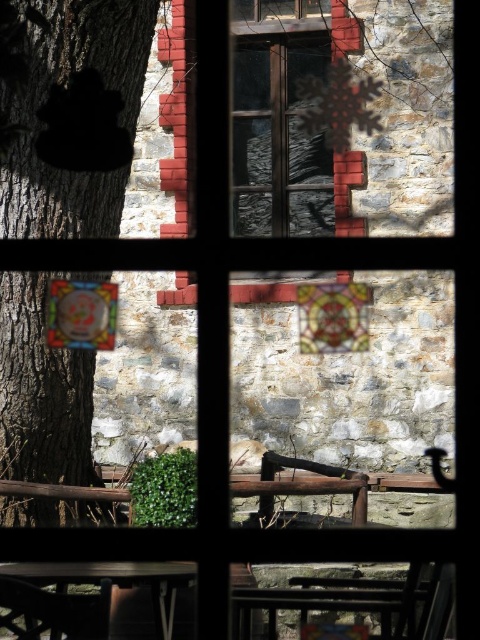
Question: Which is farther from the wooden chair at lower left?

Choices:
 (A) wooden table at lower left
 (B) brown rough bark at lower left

Answer: (B)

Question: Is brown rough bark at lower left smaller than wooden chair at lower left?

Choices:
 (A) yes
 (B) no

Answer: (B)

Question: Does wooden table at lower left have a smaller size compared to wooden chair at lower left?

Choices:
 (A) yes
 (B) no

Answer: (B)

Question: Is wooden table at lower left below wooden chair at lower left?

Choices:
 (A) no
 (B) yes

Answer: (B)

Question: Which point is closer to the camera?

Choices:
 (A) brown rough bark at lower left
 (B) wooden table at lower left
 (C) wooden chair at lower left

Answer: (C)

Question: Among these objects, which one is farthest from the camera?

Choices:
 (A) wooden chair at lower left
 (B) brown rough bark at lower left

Answer: (B)